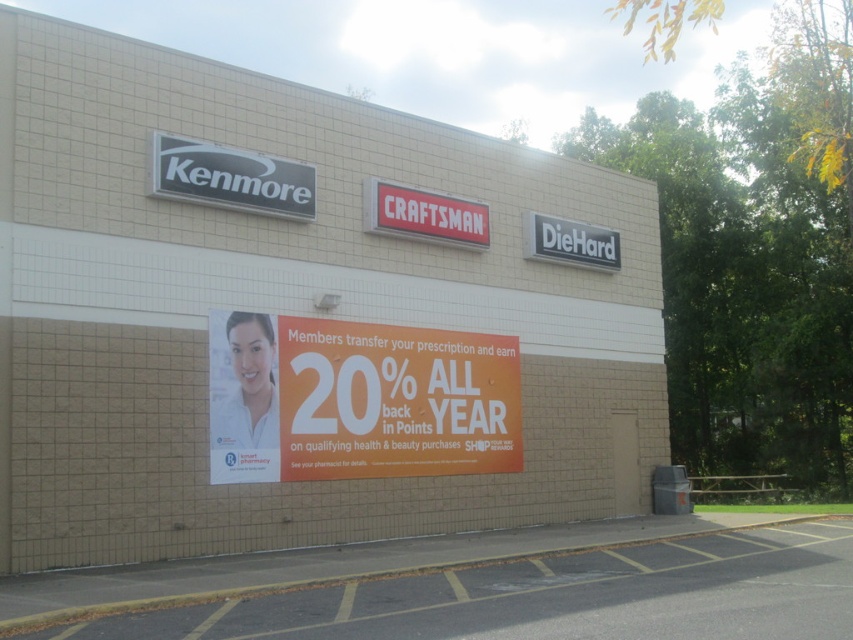
Is point (56, 256) closer to viewer compared to point (355, 394)?

That is True.

Measure the distance between point (602, 458) and camera.

A distance of 19.19 meters exists between point (602, 458) and camera.

This screenshot has height=640, width=853. What are the coordinates of `white brick wall at center` in the screenshot? It's located at (302, 320).

Which is more to the left, white brick wall at center or black plastic sign at upper center?

black plastic sign at upper center

Is white brick wall at center thinner than black plastic sign at upper center?

Incorrect, white brick wall at center's width is not less than black plastic sign at upper center's.

Where is `white brick wall at center`? The height and width of the screenshot is (640, 853). white brick wall at center is located at coordinates (302, 320).

Does point (289, 330) lie behind point (216, 170)?

Yes, it is behind point (216, 170).

Which is below, orange paper sign at center or black plastic sign at upper center?

orange paper sign at center is lower down.

Image resolution: width=853 pixels, height=640 pixels. Describe the element at coordinates (358, 400) in the screenshot. I see `orange paper sign at center` at that location.

This screenshot has width=853, height=640. I want to click on orange paper sign at center, so click(x=358, y=400).